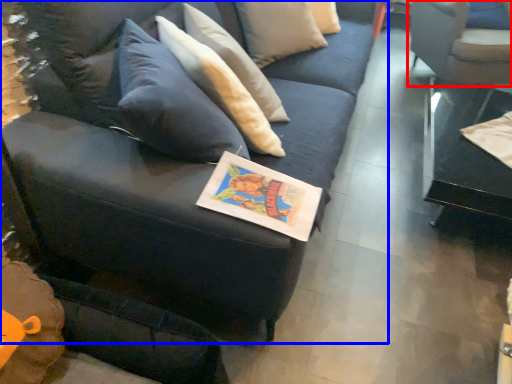
Question: Which object is closer to the camera taking this photo, chair (highlighted by a red box) or studio couch (highlighted by a blue box)?

Choices:
 (A) chair
 (B) studio couch

Answer: (B)